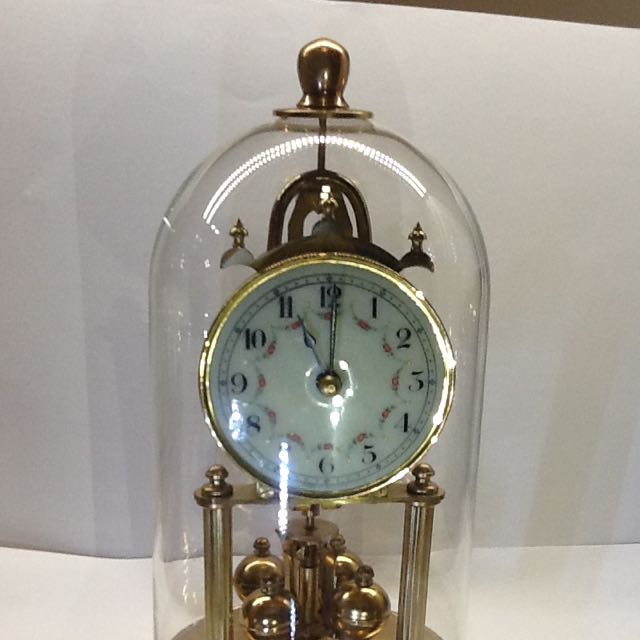
Locate an element on the screen. The width and height of the screenshot is (640, 640). clock is located at coordinates (368, 368).